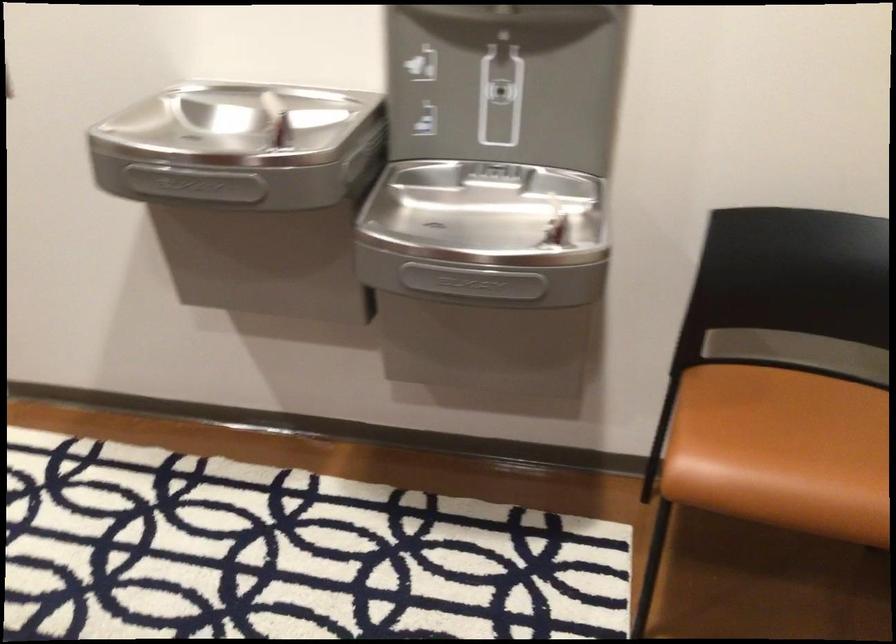
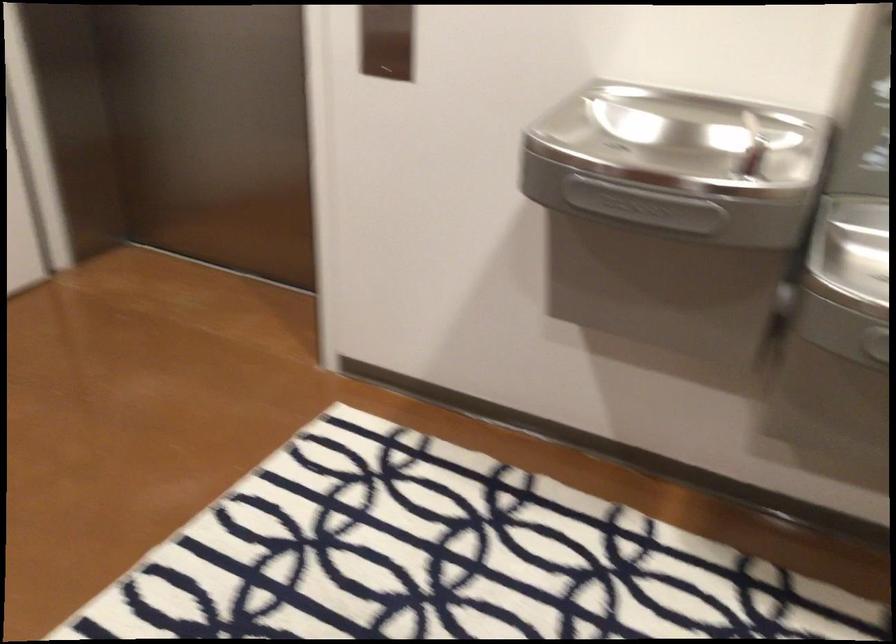
Question: What movement of the cameraman would produce the second image?

Choices:
 (A) Left
 (B) Right
 (C) Forward
 (D) Backward

Answer: (A)